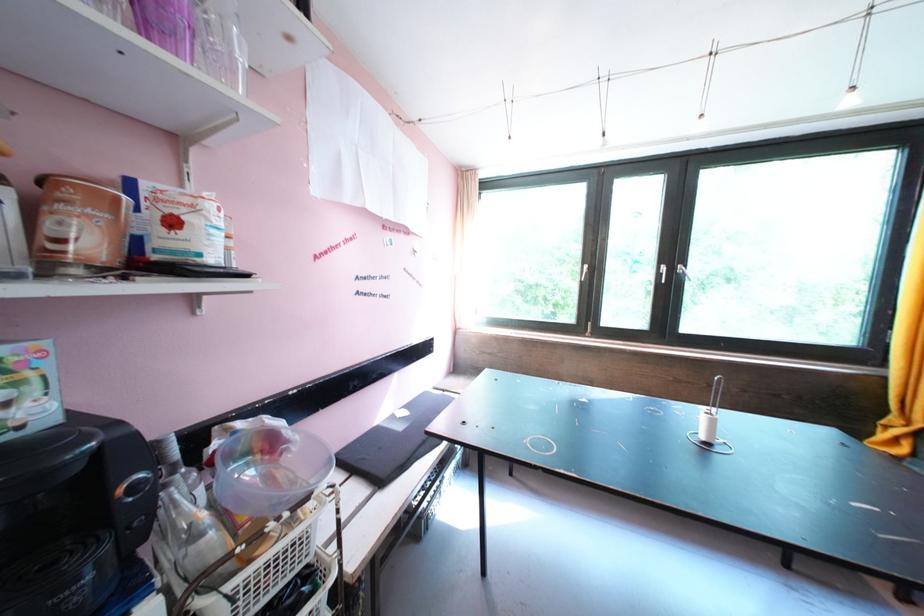
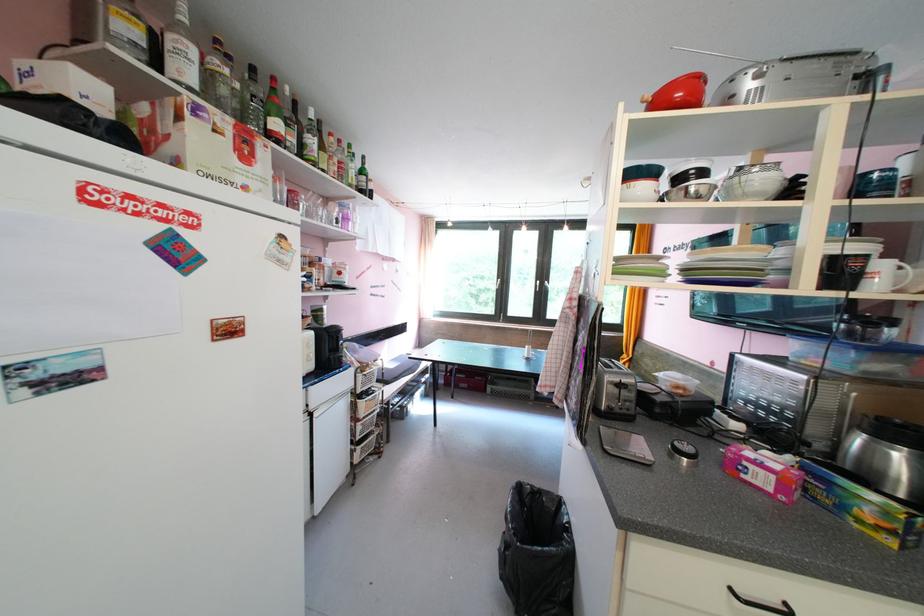
Question: In a continuous first-person perspective shot, in which direction is the camera moving?

Choices:
 (A) Left
 (B) Right
 (C) Forward
 (D) Backward

Answer: (D)